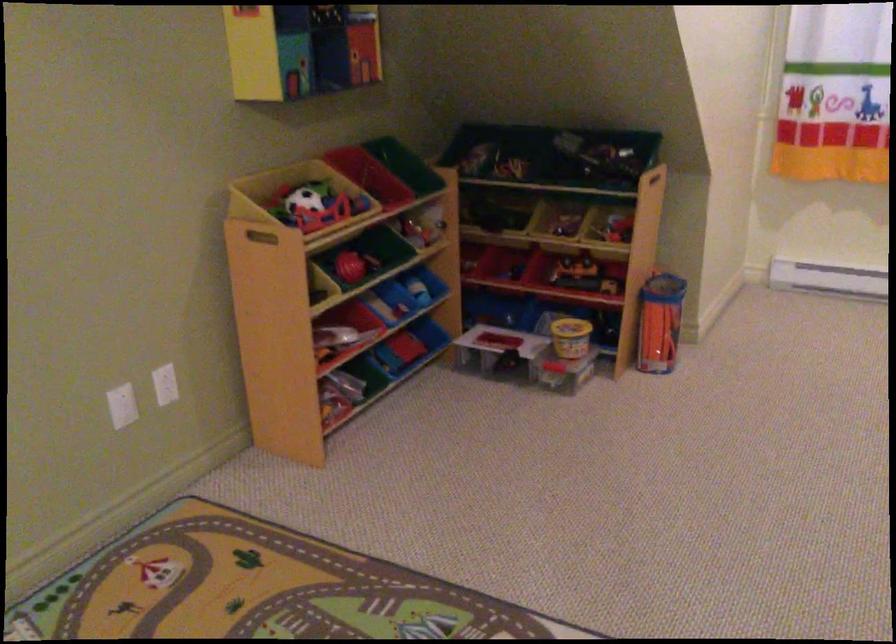
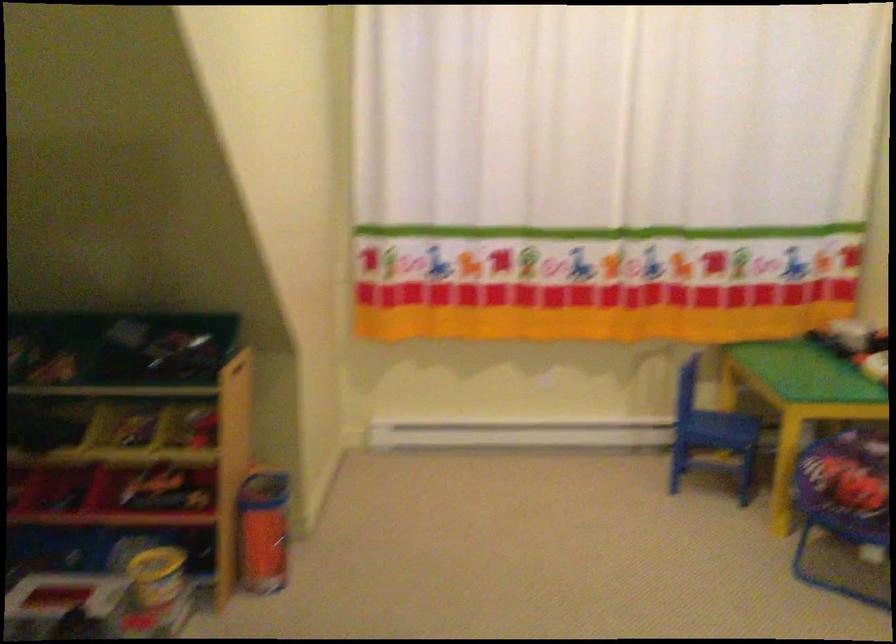
Where in the second image is the point corresponding to the point at 561,339 from the first image?

(156, 576)